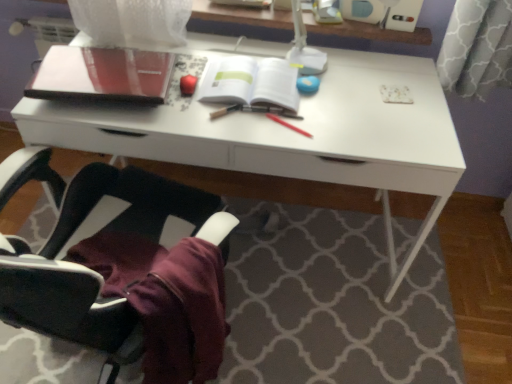
Question: Does white paper at center have a greater height compared to black fabric chair at lower left?

Choices:
 (A) yes
 (B) no

Answer: (B)

Question: Is white paper at center aimed at black fabric chair at lower left?

Choices:
 (A) yes
 (B) no

Answer: (A)

Question: Can you confirm if white paper at center is bigger than black fabric chair at lower left?

Choices:
 (A) no
 (B) yes

Answer: (A)

Question: Does white paper at center appear on the right side of black fabric chair at lower left?

Choices:
 (A) no
 (B) yes

Answer: (B)

Question: Is white paper at center at the left side of black fabric chair at lower left?

Choices:
 (A) no
 (B) yes

Answer: (A)

Question: From a real-world perspective, is white paper at center located higher than black fabric chair at lower left?

Choices:
 (A) yes
 (B) no

Answer: (A)

Question: Considering the relative sizes of glossy red apple at upper center, which ranks as the first stationery in left-to-right order, and red matte pen at center, which is the first stationery from right to left, in the image provided, is glossy red apple at upper center, which ranks as the first stationery in left-to-right order, smaller than red matte pen at center, which is the first stationery from right to left,?

Choices:
 (A) yes
 (B) no

Answer: (A)

Question: Would you say glossy red apple at upper center, marked as the third stationery in a right-to-left arrangement, is a long distance from red matte pen at center, positioned as the 3th stationery in left-to-right order?

Choices:
 (A) no
 (B) yes

Answer: (A)

Question: Is glossy red apple at upper center, which ranks as the first stationery in left-to-right order, positioned beyond the bounds of red matte pen at center, which is the first stationery from right to left?

Choices:
 (A) yes
 (B) no

Answer: (A)

Question: Considering the relative sizes of glossy red apple at upper center, marked as the third stationery in a right-to-left arrangement, and red matte pen at center, which is the first stationery from right to left, in the image provided, is glossy red apple at upper center, marked as the third stationery in a right-to-left arrangement, thinner than red matte pen at center, which is the first stationery from right to left,?

Choices:
 (A) yes
 (B) no

Answer: (A)

Question: Can you confirm if glossy red apple at upper center, which ranks as the first stationery in left-to-right order, is positioned to the right of red matte pen at center, positioned as the 3th stationery in left-to-right order?

Choices:
 (A) no
 (B) yes

Answer: (A)

Question: Does glossy red apple at upper center, which ranks as the first stationery in left-to-right order, have a greater height compared to red matte pen at center, positioned as the 3th stationery in left-to-right order?

Choices:
 (A) yes
 (B) no

Answer: (A)

Question: From the image's perspective, does matte black notebook at upper left appear higher than glossy red apple at upper center, marked as the third stationery in a right-to-left arrangement?

Choices:
 (A) no
 (B) yes

Answer: (B)